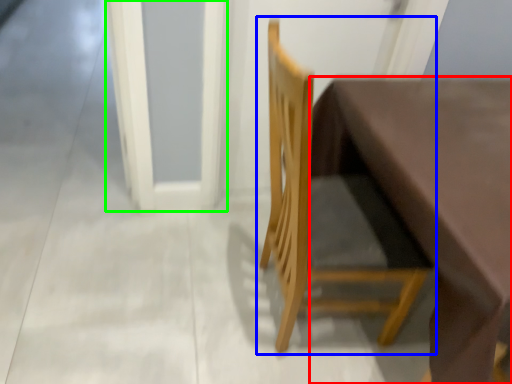
Question: Considering the real-world distances, which object is closest to table (highlighted by a red box)? chair (highlighted by a blue box) or screen door (highlighted by a green box).

Choices:
 (A) chair
 (B) screen door

Answer: (A)